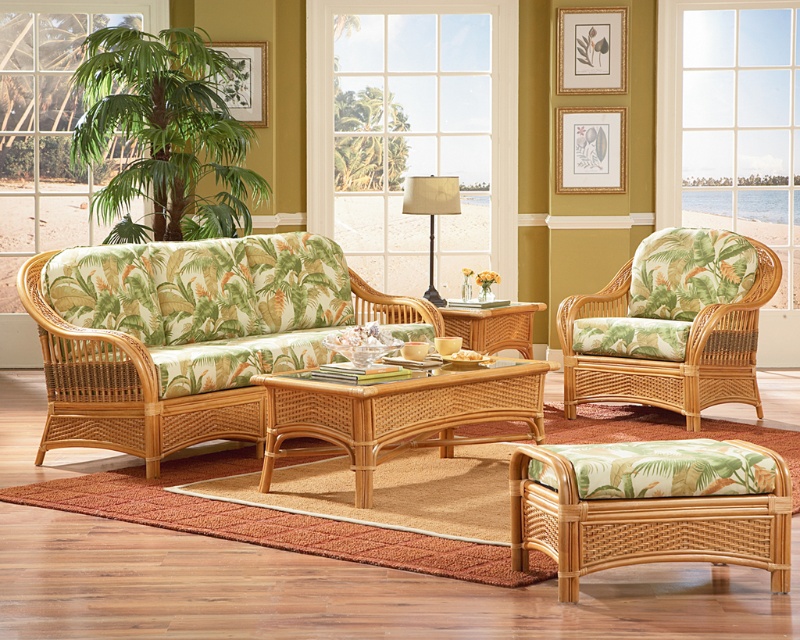
Who is positioned more to the right, woven rattan stool at lower right or matte gold picture frame at upper center?

matte gold picture frame at upper center

Consider the image. Measure the distance between point (x=512, y=547) and camera.

Point (x=512, y=547) and camera are 3.79 meters apart from each other.

Where is `woven rattan stool at lower right`? woven rattan stool at lower right is located at coordinates (644, 524).

Does transparent glass window at upper left have a greater height compared to woven wood coffee table at center?

Yes.

Can you confirm if transparent glass window at upper left is positioned above woven wood coffee table at center?

Yes.

Locate an element on the screen. transparent glass window at upper left is located at coordinates (49, 125).

Can you confirm if clear glass window at center is shorter than woven rattan stool at lower right?

Incorrect, clear glass window at center's height does not fall short of woven rattan stool at lower right's.

At what (x,y) coordinates should I click in order to perform the action: click on clear glass window at center. Please return your answer as a coordinate pair (x, y). The image size is (800, 640). Looking at the image, I should click on (420, 122).

Image resolution: width=800 pixels, height=640 pixels. Identify the location of clear glass window at center. (420, 122).